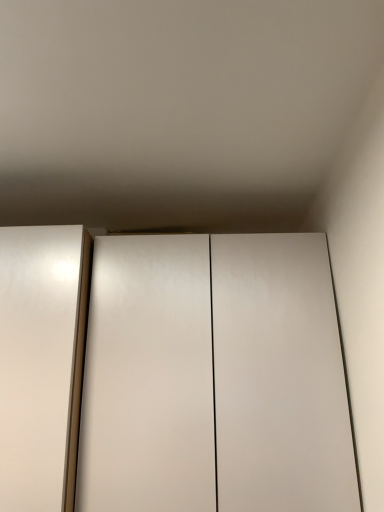
Question: Considering the positions of point (251, 492) and point (51, 472), is point (251, 492) closer or farther from the camera than point (51, 472)?

Choices:
 (A) closer
 (B) farther

Answer: (B)

Question: Considering the positions of white glossy cupboard at center and white glossy elevator at left in the image, is white glossy cupboard at center wider or thinner than white glossy elevator at left?

Choices:
 (A) wide
 (B) thin

Answer: (A)

Question: From the image's perspective, is white glossy cupboard at center above or below white glossy elevator at left?

Choices:
 (A) below
 (B) above

Answer: (A)

Question: Based on their positions, is white glossy elevator at left located to the left or right of white glossy cupboard at center?

Choices:
 (A) right
 (B) left

Answer: (B)

Question: Is point (11, 460) positioned closer to the camera than point (147, 450)?

Choices:
 (A) closer
 (B) farther

Answer: (A)

Question: From a real-world perspective, is white glossy elevator at left physically located above or below white glossy cupboard at center?

Choices:
 (A) above
 (B) below

Answer: (A)

Question: Considering their positions, is white glossy elevator at left located in front of or behind white glossy cupboard at center?

Choices:
 (A) behind
 (B) front

Answer: (B)